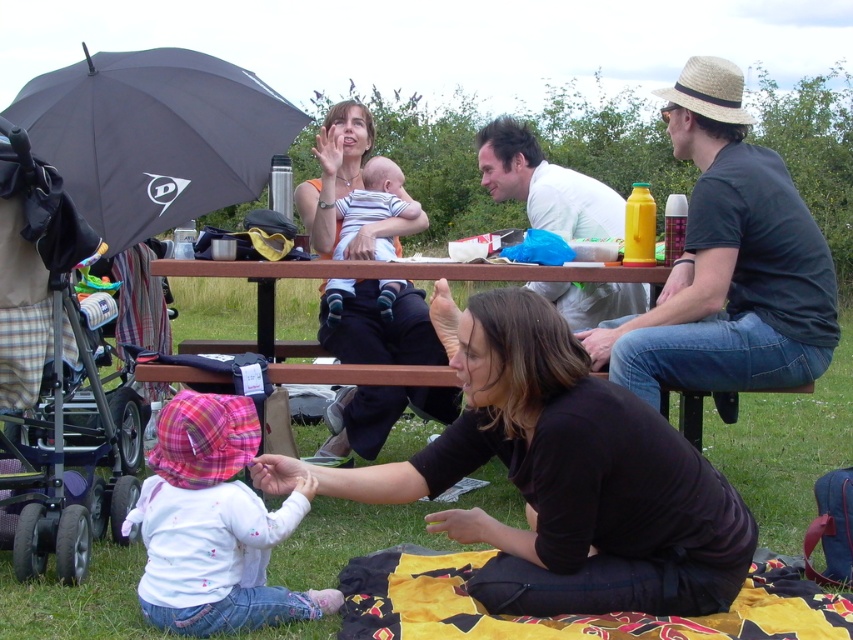
Question: Can you confirm if dark gray cotton shirt at upper right is wider than yellow patterned fabric at lower center?

Choices:
 (A) yes
 (B) no

Answer: (B)

Question: Is black matte umbrella at upper left positioned behind white matte shirt at upper center?

Choices:
 (A) no
 (B) yes

Answer: (B)

Question: Which point is farther from the camera taking this photo?

Choices:
 (A) (x=57, y=416)
 (B) (x=154, y=465)
 (C) (x=515, y=144)
 (D) (x=106, y=51)

Answer: (D)

Question: Which of the following is the closest to the observer?

Choices:
 (A) (202, 340)
 (B) (67, 544)

Answer: (B)

Question: Can you confirm if yellow patterned fabric at lower center is thinner than brown wooden picnic table at center?

Choices:
 (A) yes
 (B) no

Answer: (A)

Question: Which point appears closest to the camera in this image?

Choices:
 (A) (125, 150)
 (B) (740, 285)
 (C) (503, 413)

Answer: (C)